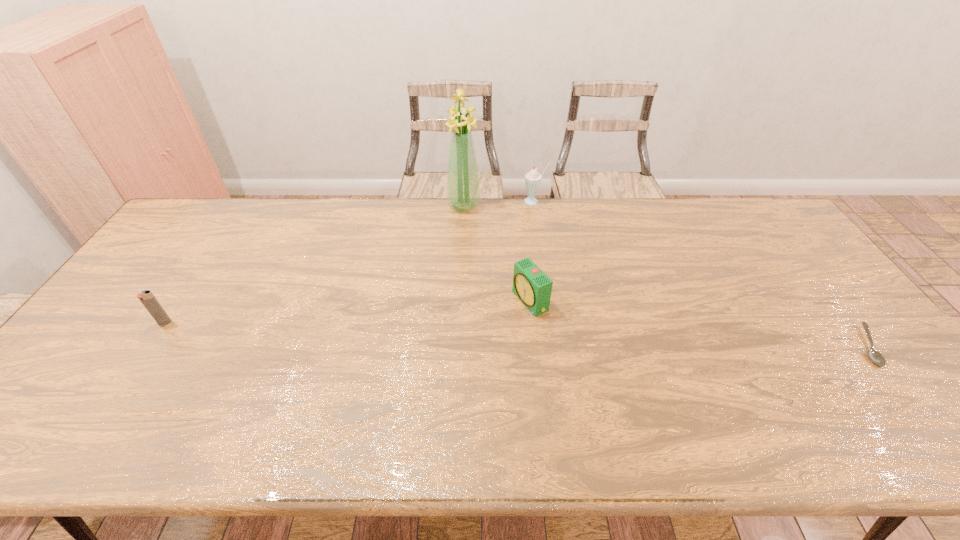
The height and width of the screenshot is (540, 960). I want to click on vacant space located on the front-facing side of the alarm clock, so click(384, 369).

You are a GUI agent. You are given a task and a screenshot of the screen. Output one action in this format:
    pyautogui.click(x=<x>, y=<y>)
    Task: Click on the free space located on the front-facing side of the alarm clock
    The width and height of the screenshot is (960, 540).
    Given the screenshot: What is the action you would take?
    pyautogui.click(x=380, y=371)

Locate an element on the screen. free location located on the straw side of the milkshake is located at coordinates (502, 252).

Locate an element on the screen. This screenshot has width=960, height=540. free location located on the straw side of the milkshake is located at coordinates (508, 243).

Where is `free space located on the straw side of the milkshake`? This screenshot has width=960, height=540. free space located on the straw side of the milkshake is located at coordinates (492, 270).

You are a GUI agent. You are given a task and a screenshot of the screen. Output one action in this format:
    pyautogui.click(x=<x>, y=<y>)
    Task: Click on the vacant space located on the front-facing side of the tallest object
    
    Given the screenshot: What is the action you would take?
    pyautogui.click(x=458, y=233)

Find the location of a particular element. The image size is (960, 540). free space located on the front-facing side of the tallest object is located at coordinates (453, 253).

The width and height of the screenshot is (960, 540). In order to click on free space located on the front-facing side of the tallest object in this screenshot , I will do `click(453, 253)`.

Locate an element on the screen. Image resolution: width=960 pixels, height=540 pixels. milkshake located in the far edge section of the desktop is located at coordinates (532, 179).

The height and width of the screenshot is (540, 960). In order to click on bouquet that is at the far edge in this screenshot , I will do `click(463, 189)`.